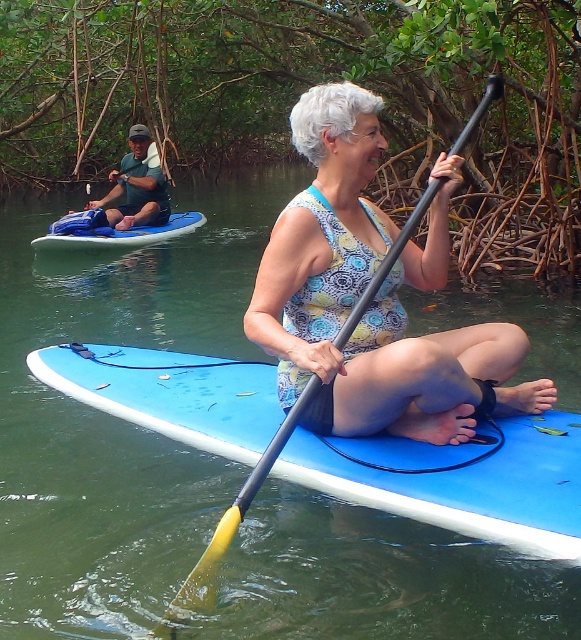
You are a photographer on a boat trying to capture both the woman on the blue paddleboard and the person in the dark green fabric shirt at upper left in the same frame. The camera has a maximum zoom range that allows capturing subjects up to 10 meters apart. Can you fit both subjects into the frame?

The two subjects are 8.49 meters apart, which is within the camera maximum zoom range of 10 meters. Yes, you can fit both the woman on the blue paddleboard and the person in the dark green fabric shirt at upper left into the frame.

You are a photographer trying to capture a clear shot of both the dark green fabric shirt at upper left and the blue foam paddleboard at left. Based on their heights, which object should you focus on first to ensure both are in frame?

The dark green fabric shirt at upper left has a greater height compared to the blue foam paddleboard at left, so you should focus on the dark green fabric shirt at upper left first to ensure both are in frame.